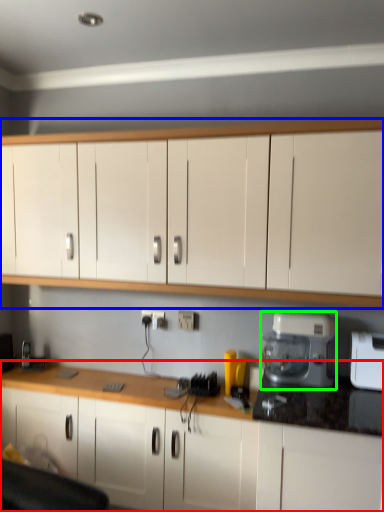
Question: Estimate the real-world distances between objects in this image. Which object is farther from cabinetry (highlighted by a red box), cabinetry (highlighted by a blue box) or home appliance (highlighted by a green box)?

Choices:
 (A) cabinetry
 (B) home appliance

Answer: (A)